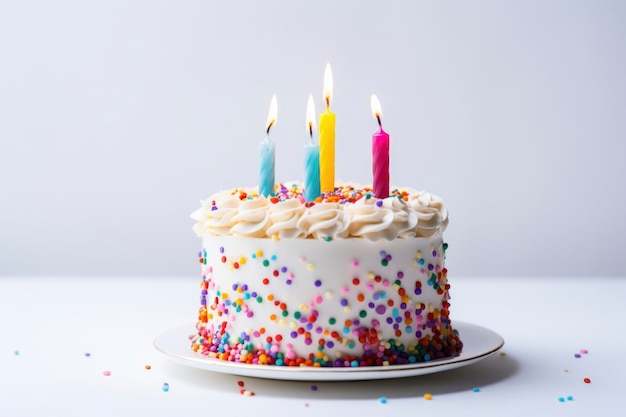
Locate an element on the screen. The height and width of the screenshot is (417, 626). candle wicks is located at coordinates (268, 128), (310, 126), (326, 101), (377, 117).